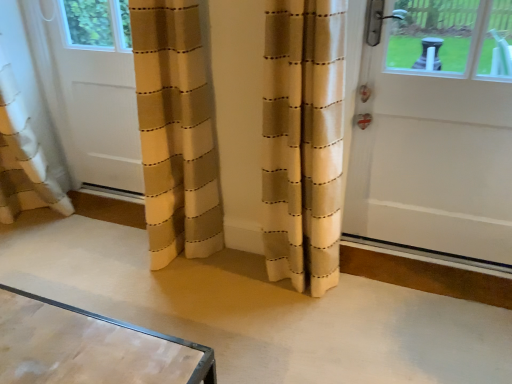
Question: From the image's perspective, does white matte door at left, marked as the 1th door in a left-to-right arrangement, appear higher than white glossy door at right, the second door from the left?

Choices:
 (A) yes
 (B) no

Answer: (A)

Question: Can you confirm if white matte door at left, marked as the 1th door in a left-to-right arrangement, is shorter than white glossy door at right, marked as the first door in a right-to-left arrangement?

Choices:
 (A) no
 (B) yes

Answer: (B)

Question: Can you confirm if white matte door at left, the 2th door in the right-to-left sequence, is wider than white glossy door at right, marked as the first door in a right-to-left arrangement?

Choices:
 (A) yes
 (B) no

Answer: (B)

Question: Can you confirm if white matte door at left, marked as the 1th door in a left-to-right arrangement, is smaller than white glossy door at right, the second door from the left?

Choices:
 (A) no
 (B) yes

Answer: (B)

Question: Can you confirm if white matte door at left, marked as the 1th door in a left-to-right arrangement, is thinner than white glossy door at right, the second door from the left?

Choices:
 (A) yes
 (B) no

Answer: (A)

Question: Are white matte door at left, the 2th door in the right-to-left sequence, and white glossy door at right, marked as the first door in a right-to-left arrangement, far apart?

Choices:
 (A) no
 (B) yes

Answer: (B)

Question: From a real-world perspective, is white glossy door at right, the second door from the left, below white matte door at left, marked as the 1th door in a left-to-right arrangement?

Choices:
 (A) yes
 (B) no

Answer: (B)

Question: Does white glossy door at right, marked as the first door in a right-to-left arrangement, touch white matte door at left, marked as the 1th door in a left-to-right arrangement?

Choices:
 (A) no
 (B) yes

Answer: (A)

Question: Can you confirm if white glossy door at right, the second door from the left, is thinner than white matte door at left, the 2th door in the right-to-left sequence?

Choices:
 (A) no
 (B) yes

Answer: (A)

Question: Is the position of white glossy door at right, marked as the first door in a right-to-left arrangement, less distant than that of white matte door at left, marked as the 1th door in a left-to-right arrangement?

Choices:
 (A) yes
 (B) no

Answer: (A)

Question: Does white glossy door at right, the second door from the left, have a smaller size compared to white matte door at left, marked as the 1th door in a left-to-right arrangement?

Choices:
 (A) yes
 (B) no

Answer: (B)

Question: Could white matte door at left, marked as the 1th door in a left-to-right arrangement, be considered to be inside white glossy door at right, the second door from the left?

Choices:
 (A) no
 (B) yes

Answer: (A)

Question: In the image, is white glossy door at right, the second door from the left, positioned in front of or behind white matte door at left, the 2th door in the right-to-left sequence?

Choices:
 (A) behind
 (B) front

Answer: (B)